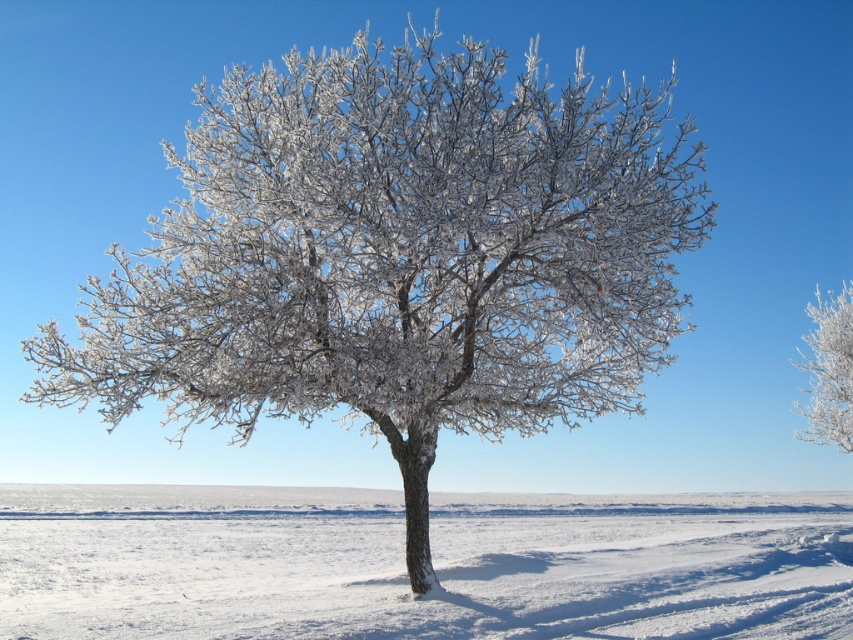
Question: Which point is farther to the camera?

Choices:
 (A) (851, 344)
 (B) (469, 554)

Answer: (A)

Question: Does white frosty snow at center have a lesser width compared to frosted white tree at right?

Choices:
 (A) yes
 (B) no

Answer: (B)

Question: Can you confirm if white frosty snow at center is positioned below frosted white tree at right?

Choices:
 (A) no
 (B) yes

Answer: (B)

Question: Does white frosty snow at center appear on the left side of frosted white tree at right?

Choices:
 (A) yes
 (B) no

Answer: (A)